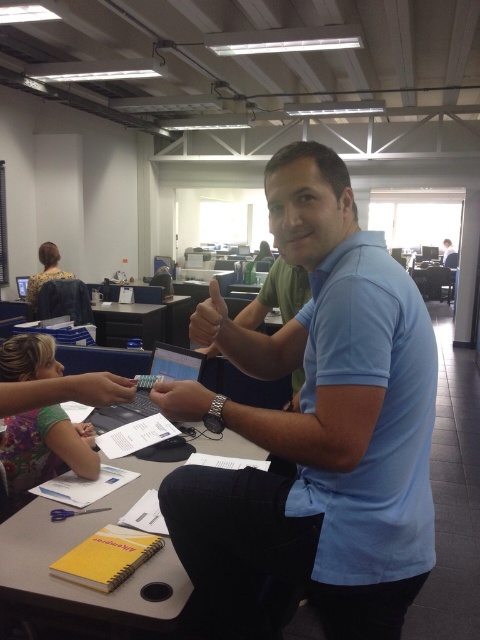
You are an office worker who needs to reach both the yellow spiral notebook at lower left and the floral print blouse at upper left. Which object is closer to you from your current position?

The yellow spiral notebook at lower left is closer to you than the floral print blouse at upper left because it is located below it.

You are an office worker who needs to place a matte black pen at center on the black plastic table at center. Can the pen fit on the table?

The black plastic table at center has a larger width than the matte black pen at center, so yes, the pen will fit on the table.

You are organizing a desk and need to place the yellow spiral notebook at lower left and the floral print blouse at upper left. Which item requires more desk space due to its larger size?

The floral print blouse at upper left requires more desk space because it is larger than the yellow spiral notebook at lower left.